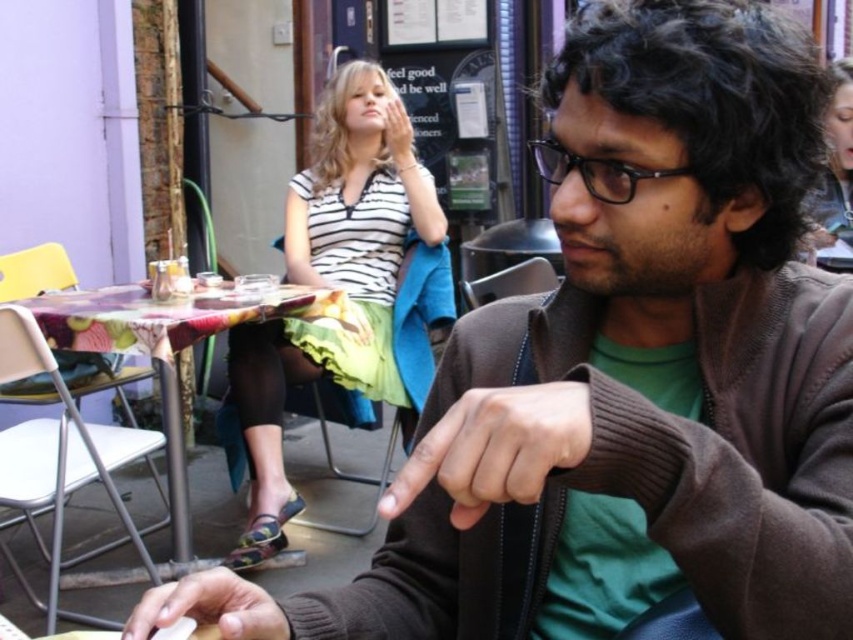
Question: Which object appears farthest from the camera in this image?

Choices:
 (A) printed fabric table at center
 (B) white striped shirt at upper center

Answer: (B)

Question: Is white striped shirt at upper center wider than printed fabric table at center?

Choices:
 (A) no
 (B) yes

Answer: (A)

Question: Does white striped shirt at upper center have a smaller size compared to printed fabric table at center?

Choices:
 (A) yes
 (B) no

Answer: (B)

Question: Among these points, which one is farthest from the camera?

Choices:
 (A) (380, 300)
 (B) (169, 436)

Answer: (A)

Question: Is white striped shirt at upper center to the left of printed fabric table at center from the viewer's perspective?

Choices:
 (A) yes
 (B) no

Answer: (B)